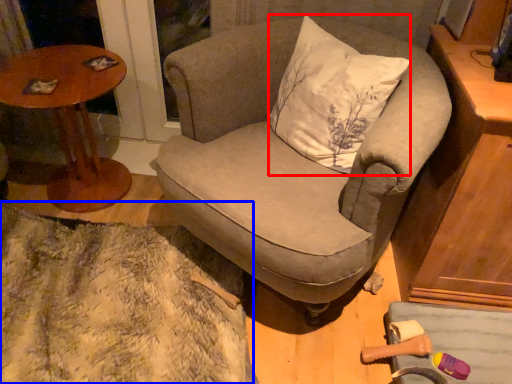
Question: Among these objects, which one is farthest to the camera, pillow (highlighted by a red box) or blanket (highlighted by a blue box)?

Choices:
 (A) pillow
 (B) blanket

Answer: (B)